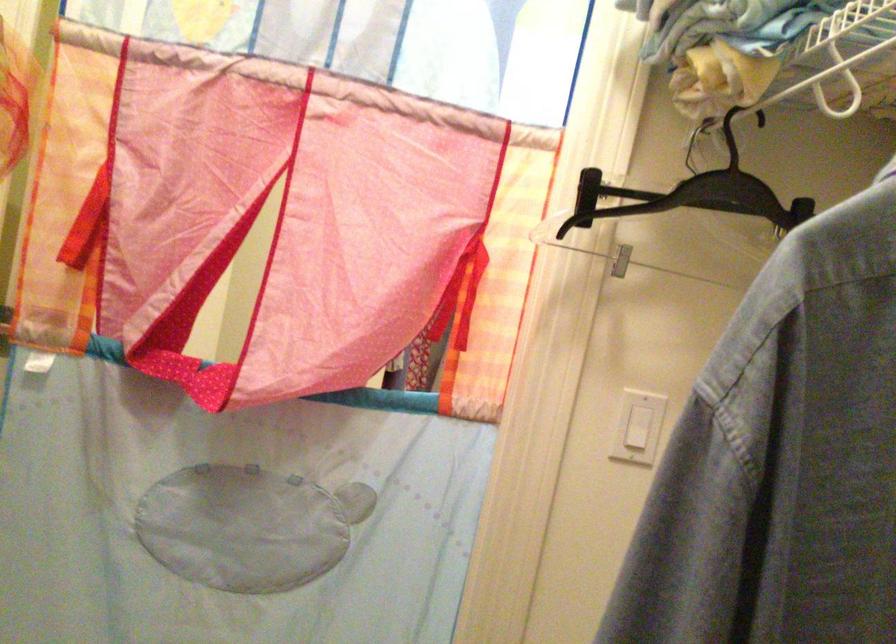
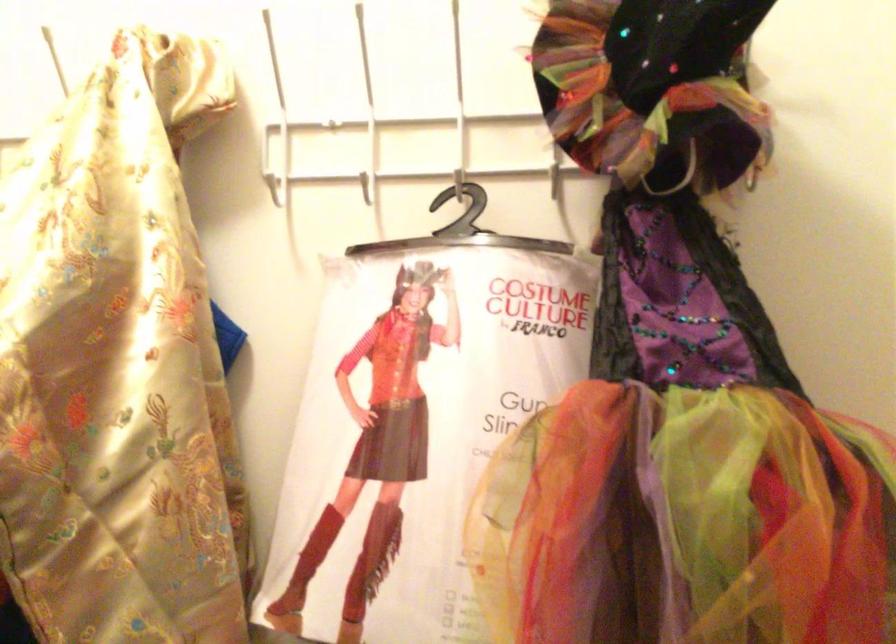
The images are taken continuously from a first-person perspective. In which direction is your viewpoint rotating?

The camera's rotation is toward left-up.